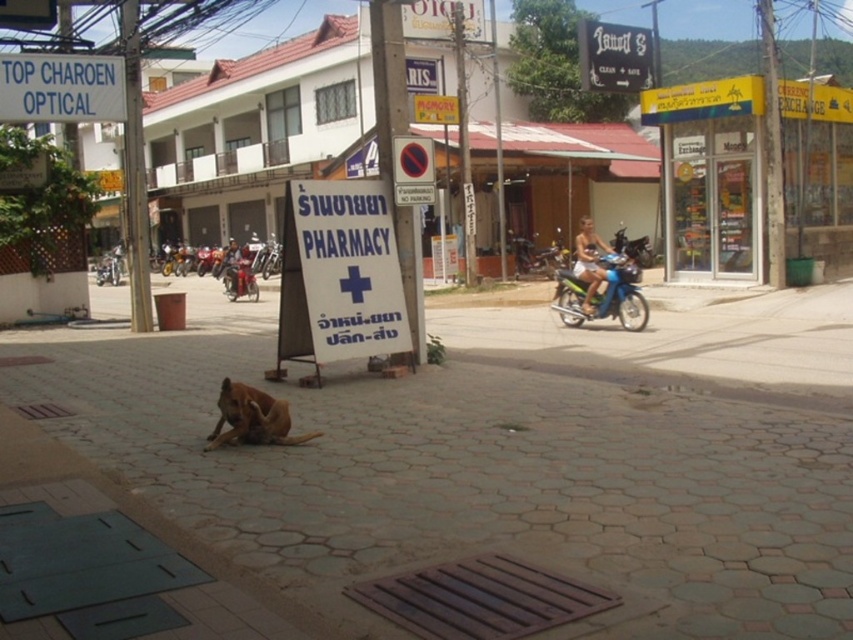
You are standing at the entrance of the pharmacy signboard. You want to move to the shiny metallic motorcycle at center. In which direction should you walk relative to the pharmacy signboard?

The shiny metallic motorcycle at center is located at point [241,280]. Since you are at the pharmacy signboard in the middle ground, you should walk towards the center of the image where the motorcycle is positioned.